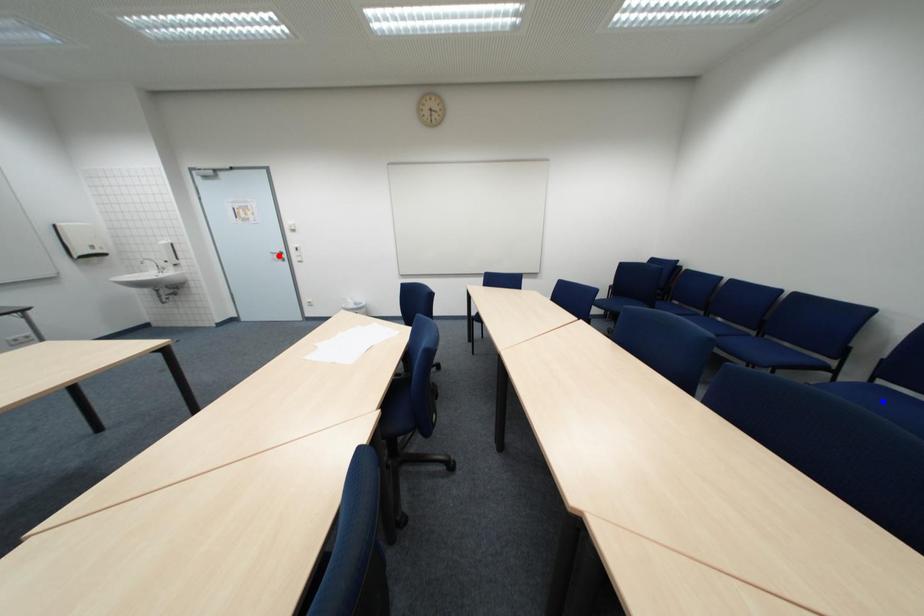
Question: Two points are marked on the image. Which point is closer to the camera?

Choices:
 (A) Blue point is closer.
 (B) Red point is closer.

Answer: (A)